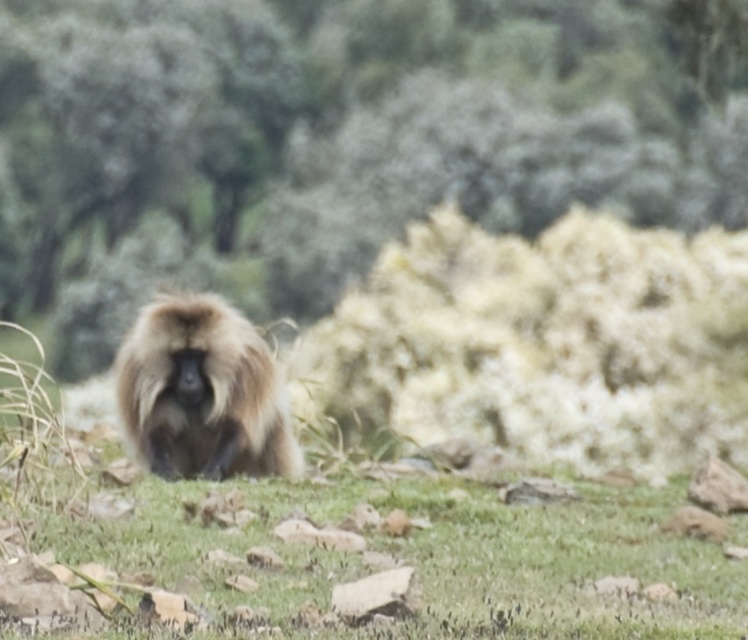
From the picture: You are a photographer trying to capture a closeup of the fuzzy brown monkey at center. You notice the green leafy tree at center is blocking your view. Can you determine which object is wider so you can decide which one to move?

The green leafy tree at center has a lesser width compared to fuzzy brown monkey at center, so you should move the green leafy tree at center since it is narrower and easier to shift out of the way.

You are standing in a savanna environment and want to reach a specific point marked as point (423,150). If your current position is 10 meters away from this point, how much further do you need to walk to reach it?

The point (423,150) is 17.93 meters from the viewer. Since you are currently 10 meters away, you need to walk an additional 7.93 meters to reach it.

You are a hiker trying to locate the fuzzy brown monkey at center in the savanna. You see the green leafy tree at center in front of you. Which direction should you move to find the monkey?

The green leafy tree at center is to the right of the fuzzy brown monkey at center, so you should move to your left to find the monkey.